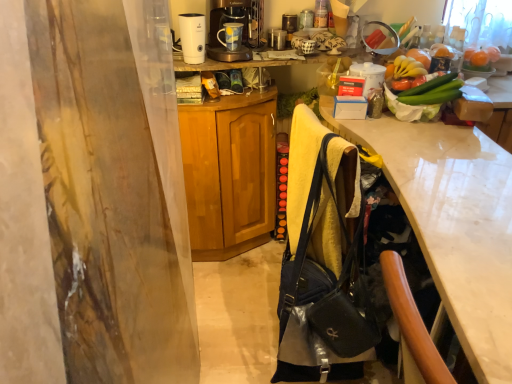
Question: Is point (233, 241) closer or farther from the camera than point (238, 11)?

Choices:
 (A) closer
 (B) farther

Answer: (B)

Question: Which is correct: wooden cabinet at center is inside metallic silver coffee maker at upper center, or outside of it?

Choices:
 (A) outside
 (B) inside

Answer: (A)

Question: Estimate the real-world distances between objects in this image. Which object is farther from the white plastic humidifier at upper center?

Choices:
 (A) orange matte fruit at upper right
 (B) metallic silver coffee maker at upper center
 (C) wooden cabinet at center
 (D) matte black handbag at center
 (E) white glossy mug at upper center, the first appliance from the right

Answer: (A)

Question: Which of these objects is positioned farthest from the metallic silver coffee maker at upper center, arranged as the second appliance when ordered from the bottom?

Choices:
 (A) white glossy mug at upper center, which appears as the 2th appliance when viewed from the top
 (B) white plastic humidifier at upper center
 (C) blue glazed mug at upper center
 (D) matte black handbag at center
 (E) white glossy desk at right

Answer: (D)